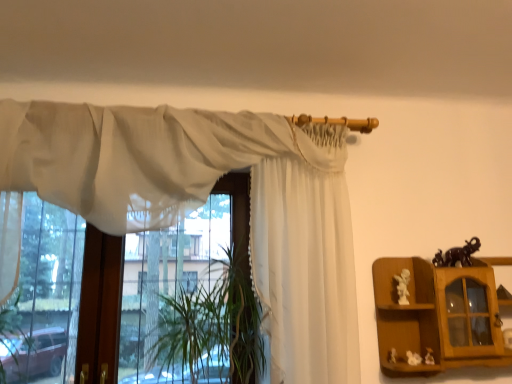
At what (x,y) coordinates should I click in order to perform the action: click on white matte figurine at lower right, the second toy positioned from the bottom. Please return your answer as a coordinate pair (x, y). This screenshot has width=512, height=384. Looking at the image, I should click on (413, 358).

How much space does white sheer curtain at center, positioned as the 1th curtain in right-to-left order, occupy horizontally?

It is 7.18 inches.

The image size is (512, 384). What do you see at coordinates (403, 286) in the screenshot? I see `white glossy statue at right, which is the second toy from top to bottom` at bounding box center [403, 286].

Measure the distance between white porcelain statue at lower right, positioned as the fourth toy in right-to-left order, and camera.

white porcelain statue at lower right, positioned as the fourth toy in right-to-left order, and camera are 5.82 feet apart.

Locate an element on the screen. white matte figurine at lower right, which ranks as the second toy in right-to-left order is located at coordinates (413, 358).

Is white porcelain statue at lower right, positioned as the fourth toy in right-to-left order, turned away from sheer white curtain at upper center, the first curtain positioned from the left?

No.

Can you confirm if white porcelain statue at lower right, positioned as the fourth toy in right-to-left order, is wider than sheer white curtain at upper center, the first curtain positioned from the left?

No, white porcelain statue at lower right, positioned as the fourth toy in right-to-left order, is not wider than sheer white curtain at upper center, the first curtain positioned from the left.

From the image's perspective, starting from the white porcelain statue at lower right, which is the 4th toy from top to bottom, which curtain is the 2nd one above? Please provide its 2D coordinates.

[(139, 157)]

Is white porcelain statue at lower right, the 1th toy ordered from the bottom, at the right side of sheer white curtain at upper center, positioned as the second curtain in right-to-left order?

Yes.

Which is in front, wooden cabinet at right or black glossy elephant at upper right, placed as the fourth toy when sorted from bottom to top?

wooden cabinet at right is more forward.

Could you measure the distance between wooden cabinet at right and black glossy elephant at upper right, positioned as the 4th toy in left-to-right order?

They are 9.49 inches apart.

Who is smaller, wooden cabinet at right or black glossy elephant at upper right, positioned as the 4th toy in left-to-right order?

Smaller between the two is black glossy elephant at upper right, positioned as the 4th toy in left-to-right order.

Can black glossy elephant at upper right, positioned as the 4th toy in left-to-right order, be found inside wooden cabinet at right?

Yes, wooden cabinet at right is surrounding black glossy elephant at upper right, positioned as the 4th toy in left-to-right order.

Is green leafy plant at center located outside black glossy elephant at upper right, the first toy when ordered from right to left?

Absolutely, green leafy plant at center is external to black glossy elephant at upper right, the first toy when ordered from right to left.

Is point (187, 302) farther from viewer compared to point (480, 245)?

That is True.

Would you say green leafy plant at center is a long distance from black glossy elephant at upper right, positioned as the first toy in top-to-bottom order?

Yes.

Is green leafy plant at center facing towards black glossy elephant at upper right, the first toy when ordered from right to left?

No, green leafy plant at center is not aimed at black glossy elephant at upper right, the first toy when ordered from right to left.

Considering the points (455, 272) and (393, 352), which point is in front, point (455, 272) or point (393, 352)?

The point (393, 352) is closer to the camera.

From the image's perspective, which is below, wooden cabinet at right or white porcelain statue at lower right, the 1th toy ordered from the bottom?

white porcelain statue at lower right, the 1th toy ordered from the bottom, appears lower in the image.

Can you confirm if wooden cabinet at right is positioned to the left of white porcelain statue at lower right, which is the 4th toy from top to bottom?

No, wooden cabinet at right is not to the left of white porcelain statue at lower right, which is the 4th toy from top to bottom.

Identify the location of shelf that appears above the white porcelain statue at lower right, positioned as the fourth toy in right-to-left order (from the image's perspective). (438, 316).

Is black glossy elephant at upper right, the first toy when ordered from right to left, surrounding white porcelain statue at lower right, positioned as the fourth toy in right-to-left order?

No, white porcelain statue at lower right, positioned as the fourth toy in right-to-left order, is located outside of black glossy elephant at upper right, the first toy when ordered from right to left.

Considering the sizes of objects black glossy elephant at upper right, the first toy when ordered from right to left, and white porcelain statue at lower right, which is the 4th toy from top to bottom, in the image provided, who is bigger, black glossy elephant at upper right, the first toy when ordered from right to left, or white porcelain statue at lower right, which is the 4th toy from top to bottom,?

black glossy elephant at upper right, the first toy when ordered from right to left, is bigger.

Between black glossy elephant at upper right, positioned as the first toy in top-to-bottom order, and white porcelain statue at lower right, positioned as the 1th toy in left-to-right order, which one has more height?

With more height is black glossy elephant at upper right, positioned as the first toy in top-to-bottom order.

Could you tell me if black glossy elephant at upper right, positioned as the first toy in top-to-bottom order, is turned towards white porcelain statue at lower right, which is the 4th toy from top to bottom?

No, black glossy elephant at upper right, positioned as the first toy in top-to-bottom order, is not turned towards white porcelain statue at lower right, which is the 4th toy from top to bottom.

Who is more distant, white sheer curtain at center, which is the 2th curtain in left-to-right order, or white glossy statue at right, the third toy positioned from the bottom?

white glossy statue at right, the third toy positioned from the bottom, is further away from the camera.

Is white sheer curtain at center, which is the 2th curtain in left-to-right order, outside of white glossy statue at right, the 3th toy from the right?

That's correct, white sheer curtain at center, which is the 2th curtain in left-to-right order, is outside of white glossy statue at right, the 3th toy from the right.

Is white glossy statue at right, the 3th toy from the right, at the back of white sheer curtain at center, which is the 2th curtain in left-to-right order?

No, white sheer curtain at center, which is the 2th curtain in left-to-right order,'s orientation is not away from white glossy statue at right, the 3th toy from the right.

Who is bigger, white sheer curtain at center, positioned as the 1th curtain in right-to-left order, or white glossy statue at right, the 3th toy from the right?

Bigger between the two is white sheer curtain at center, positioned as the 1th curtain in right-to-left order.

From a real-world perspective, is sheer white curtain at upper center, positioned as the second curtain in right-to-left order, located beneath white matte figurine at lower right, which ranks as the second toy in right-to-left order?

No.

Considering the relative sizes of sheer white curtain at upper center, positioned as the second curtain in right-to-left order, and white matte figurine at lower right, the second toy positioned from the bottom, in the image provided, is sheer white curtain at upper center, positioned as the second curtain in right-to-left order, wider than white matte figurine at lower right, the second toy positioned from the bottom,?

Indeed, sheer white curtain at upper center, positioned as the second curtain in right-to-left order, has a greater width compared to white matte figurine at lower right, the second toy positioned from the bottom.

Is sheer white curtain at upper center, the first curtain positioned from the left, aimed at white matte figurine at lower right, which ranks as the second toy in right-to-left order?

No, sheer white curtain at upper center, the first curtain positioned from the left, is not oriented towards white matte figurine at lower right, which ranks as the second toy in right-to-left order.

This screenshot has height=384, width=512. I want to click on the 4th toy below when counting from the sheer white curtain at upper center, the first curtain positioned from the left (from the image's perspective), so click(x=392, y=355).

The image size is (512, 384). Identify the location of shelf that is in front of the black glossy elephant at upper right, positioned as the 4th toy in left-to-right order. (438, 316).

Consider the image. From the image, which object appears to be farther from white matte figurine at lower right, which is counted as the 3th toy, starting from the top, white porcelain statue at lower right, which is the 4th toy from top to bottom, or black glossy elephant at upper right, placed as the fourth toy when sorted from bottom to top?

The object further to white matte figurine at lower right, which is counted as the 3th toy, starting from the top, is black glossy elephant at upper right, placed as the fourth toy when sorted from bottom to top.

Which object lies nearer to the anchor point white glossy statue at right, which is the second toy from top to bottom, white sheer curtain at center, positioned as the 1th curtain in right-to-left order, or wooden cabinet at right?

Among the two, wooden cabinet at right is located nearer to white glossy statue at right, which is the second toy from top to bottom.

Considering their positions, is black glossy elephant at upper right, placed as the fourth toy when sorted from bottom to top, positioned closer to white glossy statue at right, the 3th toy from the right, than wooden cabinet at right?

Based on the image, wooden cabinet at right appears to be nearer to white glossy statue at right, the 3th toy from the right.

From the image, which object appears to be nearer to green leafy plant at center, black glossy elephant at upper right, positioned as the 4th toy in left-to-right order, or white matte figurine at lower right, which is counted as the 3th toy, starting from the top?

Based on the image, white matte figurine at lower right, which is counted as the 3th toy, starting from the top, appears to be nearer to green leafy plant at center.

Estimate the real-world distances between objects in this image. Which object is further from black glossy elephant at upper right, positioned as the 4th toy in left-to-right order, sheer white curtain at upper center, the first curtain positioned from the left, or white sheer curtain at center, positioned as the 1th curtain in right-to-left order?

The object further to black glossy elephant at upper right, positioned as the 4th toy in left-to-right order, is sheer white curtain at upper center, the first curtain positioned from the left.

When comparing their distances from sheer white curtain at upper center, the first curtain positioned from the left, does white porcelain statue at lower right, positioned as the fourth toy in right-to-left order, or black glossy elephant at upper right, positioned as the first toy in top-to-bottom order, seem closer?

black glossy elephant at upper right, positioned as the first toy in top-to-bottom order, is positioned closer to the anchor sheer white curtain at upper center, the first curtain positioned from the left.

From the image, which object appears to be farther from black glossy elephant at upper right, the first toy when ordered from right to left, white matte figurine at lower right, the second toy positioned from the bottom, or sheer white curtain at upper center, the first curtain positioned from the left?

Based on the image, sheer white curtain at upper center, the first curtain positioned from the left, appears to be further to black glossy elephant at upper right, the first toy when ordered from right to left.

Based on their spatial positions, is white porcelain statue at lower right, which is the 4th toy from top to bottom, or white glossy statue at right, placed as the 2th toy when sorted from left to right, closer to black glossy elephant at upper right, the first toy when ordered from right to left?

white glossy statue at right, placed as the 2th toy when sorted from left to right, is closer to black glossy elephant at upper right, the first toy when ordered from right to left.

You are a GUI agent. You are given a task and a screenshot of the screen. Output one action in this format:
    pyautogui.click(x=<x>, y=<y>)
    Task: Click on the plant between sheer white curtain at upper center, the first curtain positioned from the left, and white matte figurine at lower right, the second toy positioned from the bottom, from left to right
    This screenshot has height=384, width=512.
    Given the screenshot: What is the action you would take?
    212,327

The height and width of the screenshot is (384, 512). What are the coordinates of `curtain between sheer white curtain at upper center, positioned as the second curtain in right-to-left order, and green leafy plant at center vertically` in the screenshot? It's located at (305, 255).

In order to click on toy situated between white glossy statue at right, the third toy positioned from the bottom, and wooden cabinet at right from left to right in this screenshot , I will do `click(413, 358)`.

Locate an element on the screen. plant between sheer white curtain at upper center, positioned as the second curtain in right-to-left order, and white glossy statue at right, the 3th toy from the right, in the horizontal direction is located at coordinates 212,327.